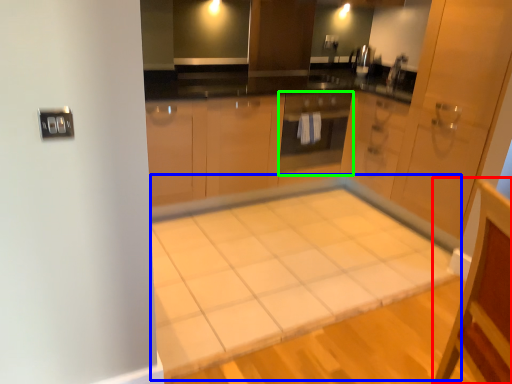
Question: Which object is positioned farthest from vanity (highlighted by a red box)? Select from table (highlighted by a blue box) and oven (highlighted by a green box).

Choices:
 (A) table
 (B) oven

Answer: (B)